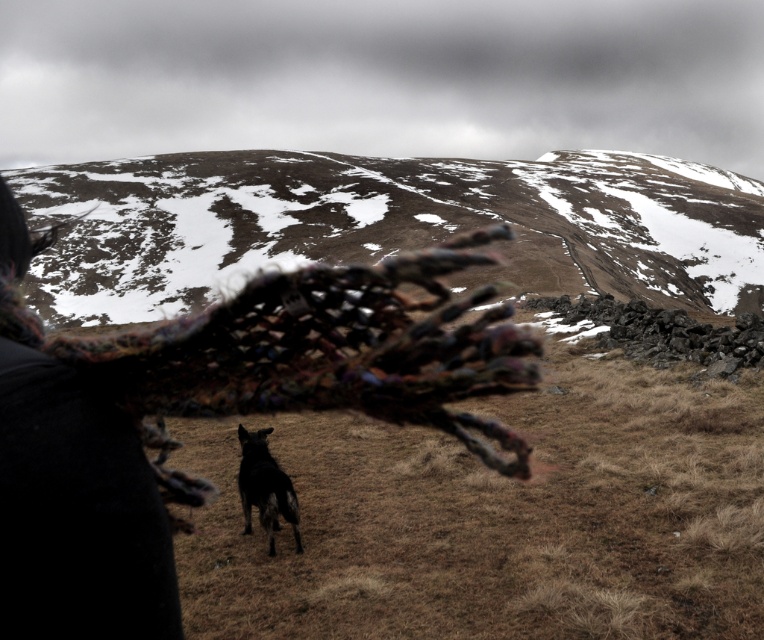
Question: Among these points, which one is nearest to the camera?

Choices:
 (A) (646, 188)
 (B) (175, 381)

Answer: (B)

Question: Is snowy brown mountain at upper center smaller than multicolored knitted shawl at center?

Choices:
 (A) no
 (B) yes

Answer: (A)

Question: Observing the image, what is the correct spatial positioning of snowy brown mountain at upper center in reference to black fur dog at center?

Choices:
 (A) above
 (B) below

Answer: (A)

Question: Is snowy brown mountain at upper center thinner than multicolored knitted shawl at center?

Choices:
 (A) no
 (B) yes

Answer: (A)

Question: Which of the following is the farthest from the observer?

Choices:
 (A) (267, 552)
 (B) (231, 272)

Answer: (B)

Question: Which point is farther from the camera taking this photo?

Choices:
 (A) (261, 520)
 (B) (610, 189)

Answer: (B)